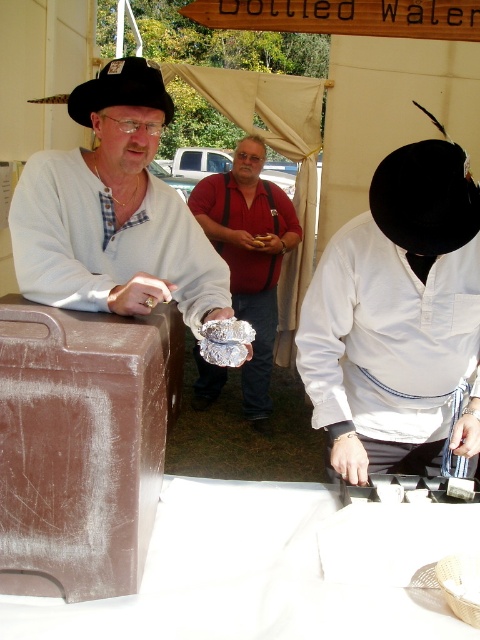
Question: Can you confirm if white matte table at lower center is positioned above black felt cowboy hat at left?

Choices:
 (A) yes
 (B) no

Answer: (B)

Question: Which object appears closest to the camera in this image?

Choices:
 (A) black felt cowboy hat at left
 (B) white matte table at lower center

Answer: (B)

Question: Is matte white shirt at left positioned before white satin shirt at center?

Choices:
 (A) yes
 (B) no

Answer: (A)

Question: Which point is farther to the camera?

Choices:
 (A) (104, 93)
 (B) (195, 268)

Answer: (B)

Question: Is matte white shirt at left further to the viewer compared to white satin shirt at center?

Choices:
 (A) yes
 (B) no

Answer: (B)

Question: Which point appears farthest from the camera in this image?

Choices:
 (A) (323, 296)
 (B) (69, 266)
 (C) (84, 122)

Answer: (A)